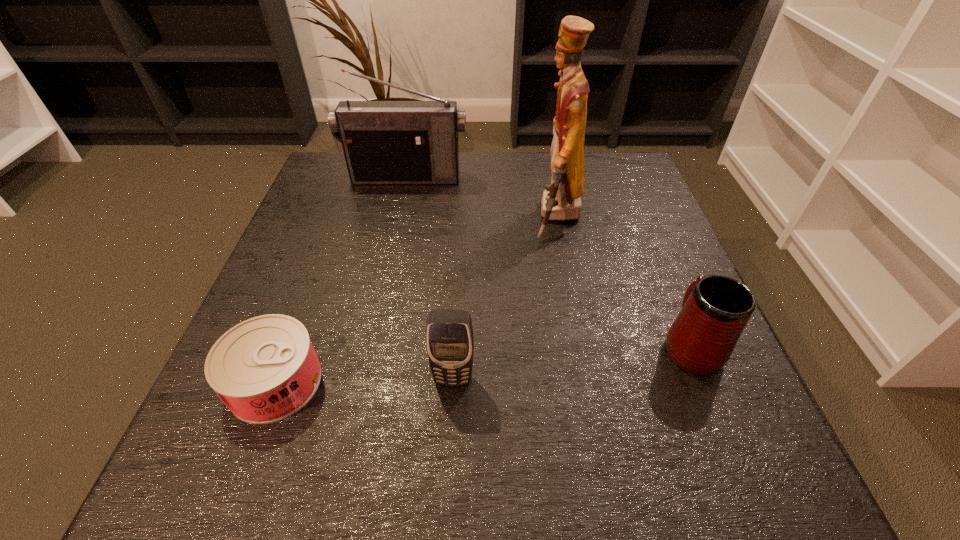
Find the location of a particular element. The height and width of the screenshot is (540, 960). object located at the far left corner is located at coordinates (384, 142).

This screenshot has width=960, height=540. Identify the location of blank space at the far edge. (443, 188).

Identify the location of vacant area at the near edge. (572, 462).

Find the location of `vacant area at the left edge of the desktop`. vacant area at the left edge of the desktop is located at coordinates (308, 215).

Where is `vacant space at the right edge of the desktop`? The image size is (960, 540). vacant space at the right edge of the desktop is located at coordinates (648, 327).

Locate an element on the screen. free space at the near left corner is located at coordinates (206, 442).

Find the location of a particular element. Image resolution: width=960 pixels, height=540 pixels. vacant region at the far right corner of the desktop is located at coordinates (620, 153).

Identify the location of free spot at the near right corner of the desktop. Image resolution: width=960 pixels, height=540 pixels. (x=730, y=443).

Find the location of `empty space that is in between the nutcracker and the radio receiver`. empty space that is in between the nutcracker and the radio receiver is located at coordinates (482, 198).

Where is `empty space between the fourth object from left to right and the cellular telephone`? This screenshot has width=960, height=540. empty space between the fourth object from left to right and the cellular telephone is located at coordinates (505, 299).